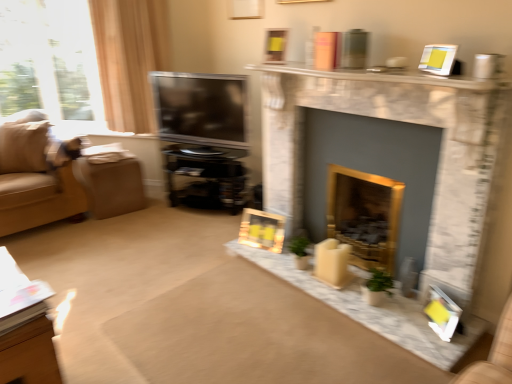
This screenshot has width=512, height=384. Find the location of `white marble fireplace at upper center`. white marble fireplace at upper center is located at coordinates (380, 76).

What is the approximate width of matte black tv at center?

matte black tv at center is 7.69 inches wide.

This screenshot has height=384, width=512. What do you see at coordinates (205, 177) in the screenshot?
I see `black glossy entertainment center at center` at bounding box center [205, 177].

At what (x,y) coordinates should I click in order to perform the action: click on gold metallic fireplace at center, acting as the 2th fireplace starting from the front. Please return your answer as a coordinate pair (x, y). Looking at the image, I should click on (364, 215).

In order to face matte yellow picture frame at upper center, positioned as the 1th picture frame in top-to-bottom order, should I rotate leftwards or rightwards?

You should look right and rotate roughly 3.110 degrees.

What is the approximate height of wooden picture frame at center, arranged as the third picture frame when viewed from the right?

It is 9.21 inches.

The image size is (512, 384). Describe the element at coordinates (262, 230) in the screenshot. I see `wooden picture frame at center, which appears as the second picture frame when ordered from the bottom` at that location.

The height and width of the screenshot is (384, 512). Describe the element at coordinates (401, 121) in the screenshot. I see `marble fireplace at center, the 1th fireplace in the front-to-back sequence` at that location.

You are a GUI agent. You are given a task and a screenshot of the screen. Output one action in this format:
    pyautogui.click(x=<x>, y=<y>)
    Task: Click on the white marble fireplace at upper center
    Image resolution: width=512 pixels, height=384 pixels.
    Given the screenshot: What is the action you would take?
    tap(380, 76)

How different are the orientations of wooden picture frame at center, the first picture frame when ordered from back to front, and wooden table at lower left in degrees?

wooden picture frame at center, the first picture frame when ordered from back to front, and wooden table at lower left are facing 165 degrees away from each other.

From a real-world perspective, is wooden picture frame at center, the 2th picture frame positioned from the top, above or below wooden table at lower left?

Clearly, from a real-world perspective, wooden picture frame at center, the 2th picture frame positioned from the top, is below wooden table at lower left.

Is wooden picture frame at center, the first picture frame when ordered from back to front, oriented towards wooden table at lower left?

Yes, wooden picture frame at center, the first picture frame when ordered from back to front, faces towards wooden table at lower left.

Which is behind, wooden picture frame at center, arranged as the third picture frame when viewed from the right, or wooden table at lower left?

wooden picture frame at center, arranged as the third picture frame when viewed from the right, is more distant.

Does brown fabric footrest at left come in front of wooden table at lower left?

No, the depth of brown fabric footrest at left is greater than that of wooden table at lower left.

From the picture: Considering the sizes of objects brown fabric footrest at left and wooden table at lower left in the image provided, who is wider, brown fabric footrest at left or wooden table at lower left?

Wider between the two is brown fabric footrest at left.

Which object is positioned more to the right, brown fabric footrest at left or wooden table at lower left?

Positioned to the right is wooden table at lower left.

Is brown fabric footrest at left oriented towards wooden table at lower left?

No, brown fabric footrest at left is not facing towards wooden table at lower left.

Can you tell me how much suede beige couch at left and black glossy entertainment center at center differ in facing direction?

The angular difference between suede beige couch at left and black glossy entertainment center at center is 65.8 degrees.

From a real-world perspective, is suede beige couch at left beneath black glossy entertainment center at center?

No, from a real-world perspective, suede beige couch at left is not below black glossy entertainment center at center.

In the scene shown: Considering the sizes of suede beige couch at left and black glossy entertainment center at center in the image, is suede beige couch at left taller or shorter than black glossy entertainment center at center?

Clearly, suede beige couch at left is taller compared to black glossy entertainment center at center.

Is suede beige couch at left positioned far away from black glossy entertainment center at center?

No, suede beige couch at left is not far from black glossy entertainment center at center.

Considering the relative sizes of marble fireplace at center, which appears as the 2th fireplace when viewed from the back, and matte yellow picture frame at upper center, which ranks as the 2th picture frame in right-to-left order, in the image provided, is marble fireplace at center, which appears as the 2th fireplace when viewed from the back, shorter than matte yellow picture frame at upper center, which ranks as the 2th picture frame in right-to-left order,?

In fact, marble fireplace at center, which appears as the 2th fireplace when viewed from the back, may be taller than matte yellow picture frame at upper center, which ranks as the 2th picture frame in right-to-left order.

How distant is marble fireplace at center, the 1th fireplace in the front-to-back sequence, from matte yellow picture frame at upper center, which ranks as the 2th picture frame in right-to-left order?

marble fireplace at center, the 1th fireplace in the front-to-back sequence, is 28.51 inches from matte yellow picture frame at upper center, which ranks as the 2th picture frame in right-to-left order.

In the scene shown: Which is more to the left, marble fireplace at center, which appears as the 2th fireplace when viewed from the back, or matte yellow picture frame at upper center, positioned as the 2th picture frame in back-to-front order?

Positioned to the left is matte yellow picture frame at upper center, positioned as the 2th picture frame in back-to-front order.

From a real-world perspective, is marble fireplace at center, the 1th fireplace in the front-to-back sequence, on top of matte yellow picture frame at upper center, positioned as the 1th picture frame in top-to-bottom order?

No, from a real-world perspective, marble fireplace at center, the 1th fireplace in the front-to-back sequence, is not over matte yellow picture frame at upper center, positioned as the 1th picture frame in top-to-bottom order

Is matte yellow picture frame at upper center, positioned as the 2th picture frame in back-to-front order, at the back of matte white picture frame at lower right, positioned as the third picture frame in left-to-right order?

matte white picture frame at lower right, positioned as the third picture frame in left-to-right order, is not turned away from matte yellow picture frame at upper center, positioned as the 2th picture frame in back-to-front order.

What's the angular difference between matte white picture frame at lower right, the 3th picture frame positioned from the top, and matte yellow picture frame at upper center, marked as the second picture frame in a front-to-back arrangement,'s facing directions?

matte white picture frame at lower right, the 3th picture frame positioned from the top, and matte yellow picture frame at upper center, marked as the second picture frame in a front-to-back arrangement, are facing 49.4 degrees away from each other.

Does matte white picture frame at lower right, which is counted as the 1th picture frame, starting from the bottom, lie in front of matte yellow picture frame at upper center, which ranks as the 2th picture frame in right-to-left order?

Yes.

Is matte white picture frame at lower right, which is counted as the first picture frame, starting from the front, not within matte yellow picture frame at upper center, marked as the second picture frame in a front-to-back arrangement?

Yes.

From a real-world perspective, is black glossy entertainment center at center positioned over suede beige couch at left based on gravity?

No.

Which of these two, black glossy entertainment center at center or suede beige couch at left, is thinner?

Thinner between the two is black glossy entertainment center at center.

I want to click on entertainment center that is behind the suede beige couch at left, so click(205, 177).

Is black glossy entertainment center at center next to suede beige couch at left?

No.

Is brown fabric footrest at left wider or thinner than marble fireplace at center, the 1th fireplace in the front-to-back sequence?

Clearly, brown fabric footrest at left has more width compared to marble fireplace at center, the 1th fireplace in the front-to-back sequence.

How different are the orientations of brown fabric footrest at left and marble fireplace at center, which appears as the 2th fireplace when viewed from the back, in degrees?

brown fabric footrest at left and marble fireplace at center, which appears as the 2th fireplace when viewed from the back, are facing 81.2 degrees away from each other.

Considering the sizes of brown fabric footrest at left and marble fireplace at center, the 1th fireplace in the front-to-back sequence, in the image, is brown fabric footrest at left taller or shorter than marble fireplace at center, the 1th fireplace in the front-to-back sequence,?

Clearly, brown fabric footrest at left is shorter compared to marble fireplace at center, the 1th fireplace in the front-to-back sequence.

Is brown fabric footrest at left far from marble fireplace at center, the 1th fireplace in the front-to-back sequence?

Indeed, brown fabric footrest at left is not near marble fireplace at center, the 1th fireplace in the front-to-back sequence.

From the image's perspective, which picture frame is the 2nd one above the wooden table at lower left? Please provide its 2D coordinates.

[(262, 230)]

Locate an element on the screen. table in front of the brown fabric footrest at left is located at coordinates (25, 328).

Which object lies further to the anchor point wooden picture frame at center, which appears as the second picture frame when ordered from the bottom, wooden table at lower left or marble fireplace at center, which appears as the 2th fireplace when viewed from the back?

wooden table at lower left.

Based on their spatial positions, is brown fabric footrest at left or matte black tv at center further from matte white picture frame at lower right, which is counted as the first picture frame, starting from the front?

brown fabric footrest at left is positioned further to the anchor matte white picture frame at lower right, which is counted as the first picture frame, starting from the front.

Which object lies nearer to the anchor point matte black tv at center, matte yellow picture frame at upper center, which ranks as the 2th picture frame in right-to-left order, or wooden picture frame at center, which appears as the second picture frame when ordered from the bottom?

matte yellow picture frame at upper center, which ranks as the 2th picture frame in right-to-left order, is positioned closer to the anchor matte black tv at center.

Which object lies further to the anchor point brown fabric footrest at left, white marble fireplace at upper center or matte yellow picture frame at upper center, marked as the second picture frame in a front-to-back arrangement?

white marble fireplace at upper center is further to brown fabric footrest at left.

Estimate the real-world distances between objects in this image. Which object is closer to matte black tv at center, black glossy entertainment center at center or wooden picture frame at center, placed as the 1th picture frame when sorted from left to right?

Based on the image, black glossy entertainment center at center appears to be nearer to matte black tv at center.

Looking at the image, which one is located closer to marble fireplace at center, which appears as the 2th fireplace when viewed from the back, wooden picture frame at center, which appears as the second picture frame when ordered from the bottom, or matte black tv at center?

wooden picture frame at center, which appears as the second picture frame when ordered from the bottom, is positioned closer to the anchor marble fireplace at center, which appears as the 2th fireplace when viewed from the back.

Based on their spatial positions, is wooden table at lower left or white marble fireplace at upper center further from suede beige couch at left?

The object further to suede beige couch at left is white marble fireplace at upper center.

When comparing their distances from matte black tv at center, does brown fabric footrest at left or gold metallic fireplace at center, which appears as the 1th fireplace when viewed from the back, seem closer?

Among the two, brown fabric footrest at left is located nearer to matte black tv at center.

You are a GUI agent. You are given a task and a screenshot of the screen. Output one action in this format:
    pyautogui.click(x=<x>, y=<y>)
    Task: Click on the studio couch positioned between wooden table at lower left and black glossy entertainment center at center from near to far
    The width and height of the screenshot is (512, 384).
    Given the screenshot: What is the action you would take?
    click(x=36, y=174)

This screenshot has height=384, width=512. In order to click on mantle between suede beige couch at left and gold metallic fireplace at center, which appears as the 1th fireplace when viewed from the back, from left to right in this screenshot , I will do `click(380, 76)`.

The height and width of the screenshot is (384, 512). Find the location of `television between matte yellow picture frame at upper center, positioned as the 1th picture frame in top-to-bottom order, and black glossy entertainment center at center, along the z-axis`. television between matte yellow picture frame at upper center, positioned as the 1th picture frame in top-to-bottom order, and black glossy entertainment center at center, along the z-axis is located at coordinates (201, 108).

Locate an element on the screen. This screenshot has height=384, width=512. entertainment center located between matte black tv at center and gold metallic fireplace at center, acting as the 2th fireplace starting from the front, in the left-right direction is located at coordinates (205, 177).